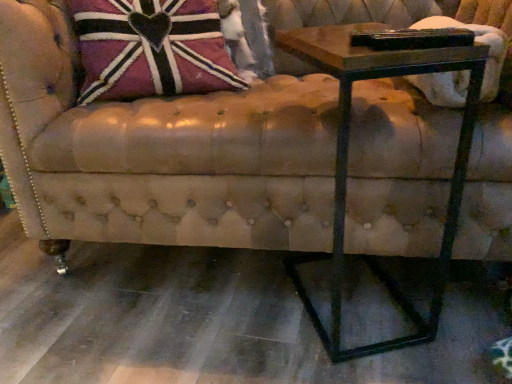
The image size is (512, 384). In order to click on free point below wooden table at right (from a real-world perspective) in this screenshot , I will do coord(356,320).